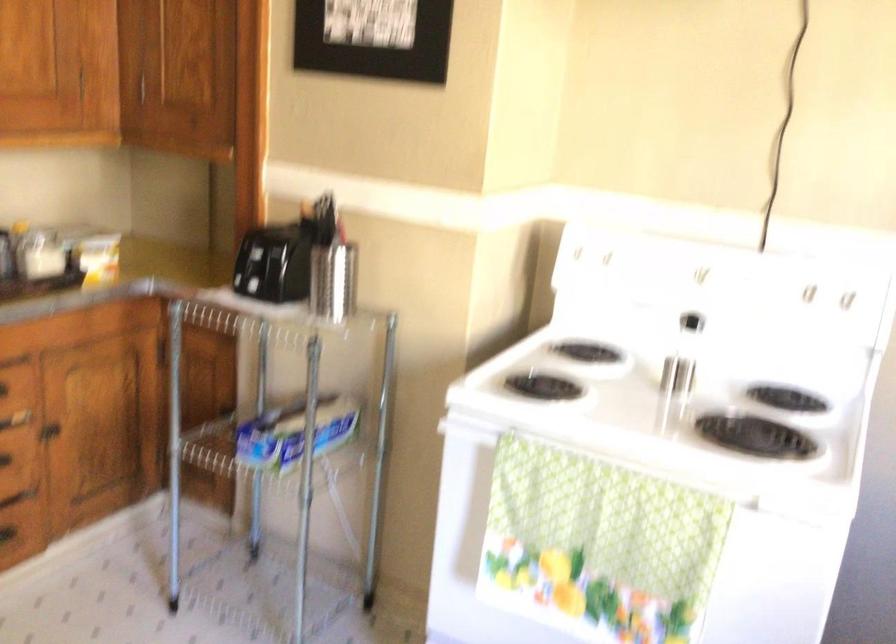
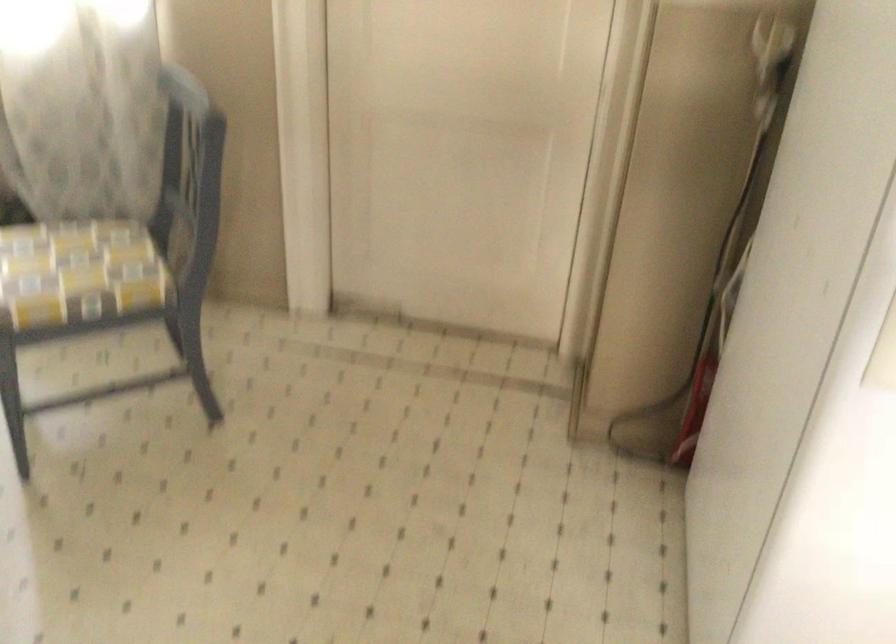
Based on the continuous images, in which direction is the camera rotating?

The camera rotated toward left-down.